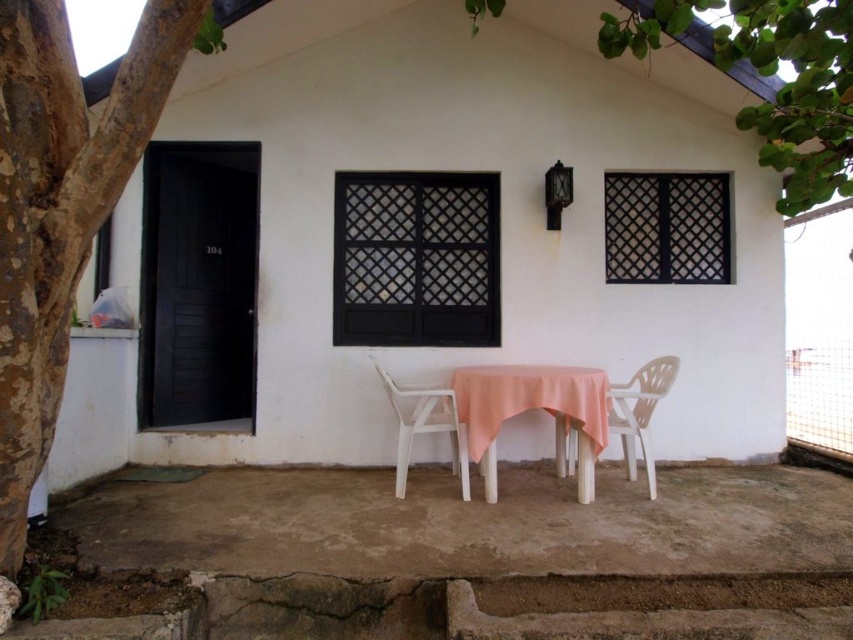
You are a painter standing at the edge of the patio. You want to paint the white plastic chair at center without the green leafy tree at upper center blocking your view. Can you move the chair to a position where the tree won

The green leafy tree at upper center is much taller than the white plastic chair at center. Since the tree is taller, it will likely block the view of the chair from certain angles. To ensure the tree doesn

You are standing on the patio and want to place a small potted plant exactly at the location marked by the smooth brown bark at left. According to the scene description, where should you place the potted plant?

The smooth brown bark at left is located at point coordinates of (61, 208), so you should place the potted plant at that exact point.